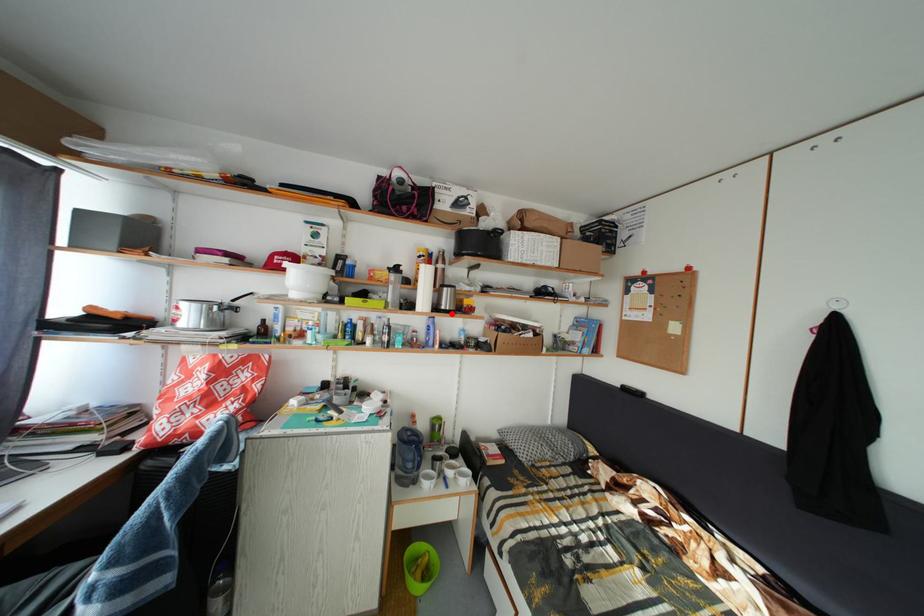
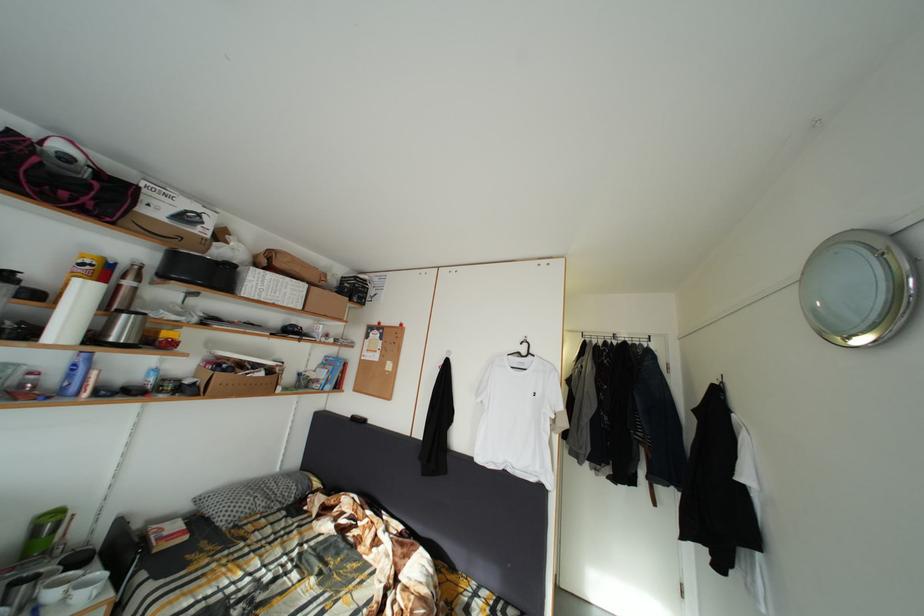
Find the pixel in the second image that matches the highlighted location in the first image.

(120, 345)